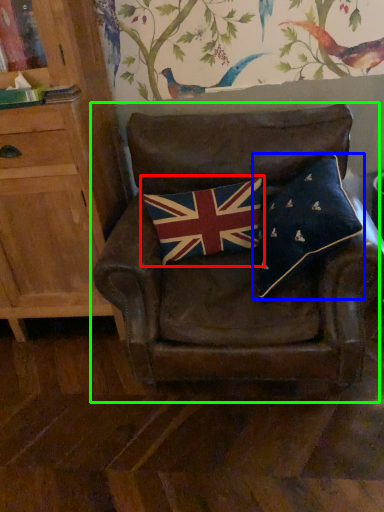
Question: Which object is positioned closest to flag (highlighted by a red box)? Select from pillow (highlighted by a blue box) and chair (highlighted by a green box).

Choices:
 (A) pillow
 (B) chair

Answer: (B)